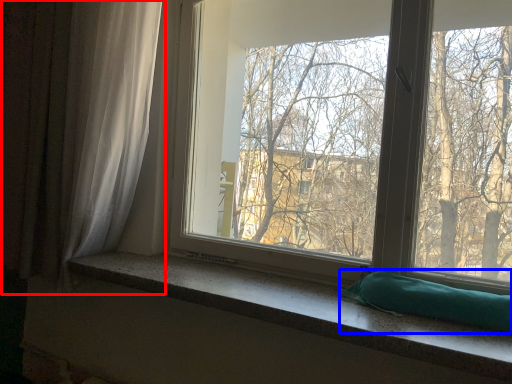
Question: Which object is closer to the camera taking this photo, curtain (highlighted by a red box) or pillow (highlighted by a blue box)?

Choices:
 (A) curtain
 (B) pillow

Answer: (B)